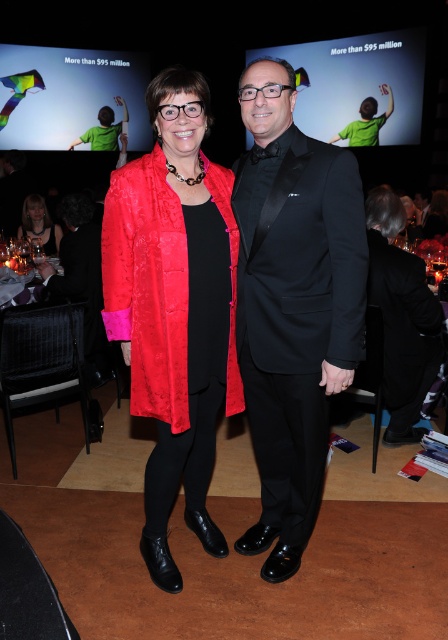
Question: Which of the following is the farthest from the observer?

Choices:
 (A) shiny red coat at center
 (B) matte black suit at center
 (C) matte black dress at center
 (D) black satin tuxedo at center

Answer: (B)

Question: Among these points, which one is farthest from the camera?

Choices:
 (A) (262, 310)
 (B) (47, 241)
 (C) (120, 202)
 (D) (358, 120)

Answer: (D)

Question: Where is shiny red coat at center located in relation to matte black dress at center in the image?

Choices:
 (A) above
 (B) below

Answer: (B)

Question: Among these objects, which one is nearest to the camera?

Choices:
 (A) matte red dress at center
 (B) shiny red coat at center
 (C) matte black dress at center
 (D) matte black suit at center

Answer: (B)

Question: Considering the relative positions of matte black suit at center and green fabric shirt at upper left in the image provided, where is matte black suit at center located with respect to green fabric shirt at upper left?

Choices:
 (A) left
 (B) right

Answer: (B)

Question: Is matte black dress at center bigger than green fabric shirt at upper left?

Choices:
 (A) yes
 (B) no

Answer: (B)